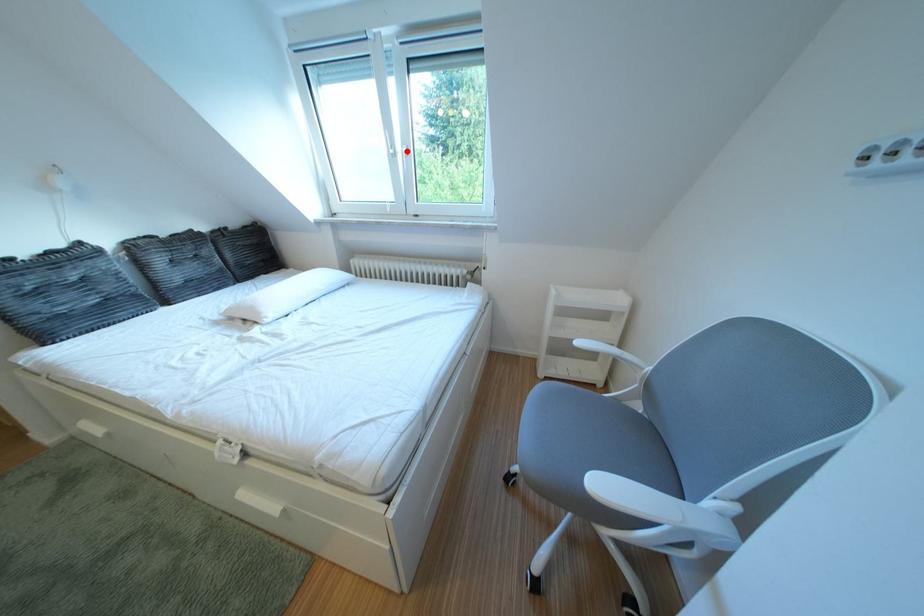
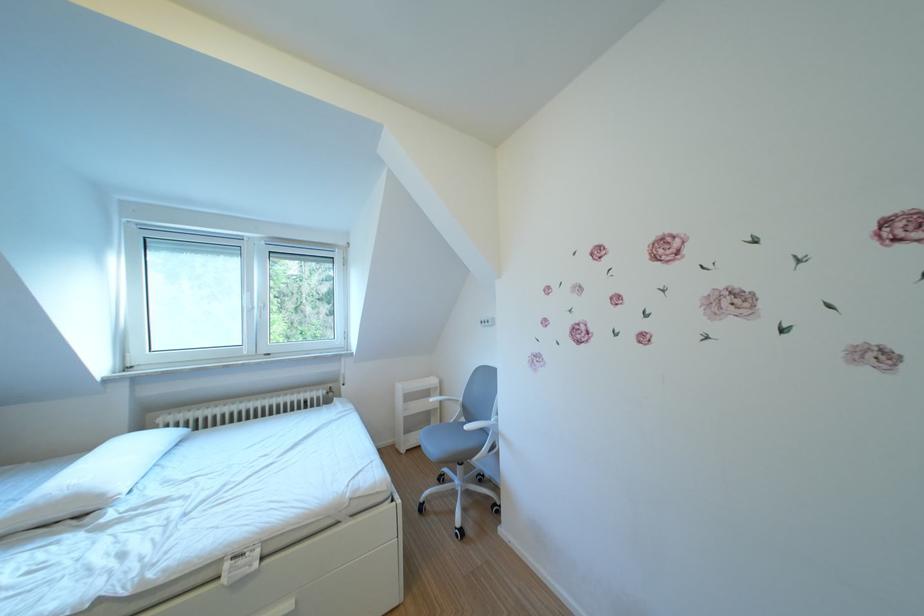
In the second image, find the point that corresponds to the highlighted location in the first image.

(265, 307)